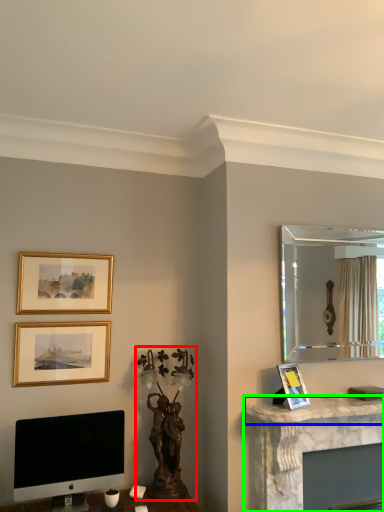
Question: Estimate the real-world distances between objects in this image. Which object is closer to sculpture (highlighted by a red box), counter top (highlighted by a blue box) or computer desk (highlighted by a green box)?

Choices:
 (A) counter top
 (B) computer desk

Answer: (A)